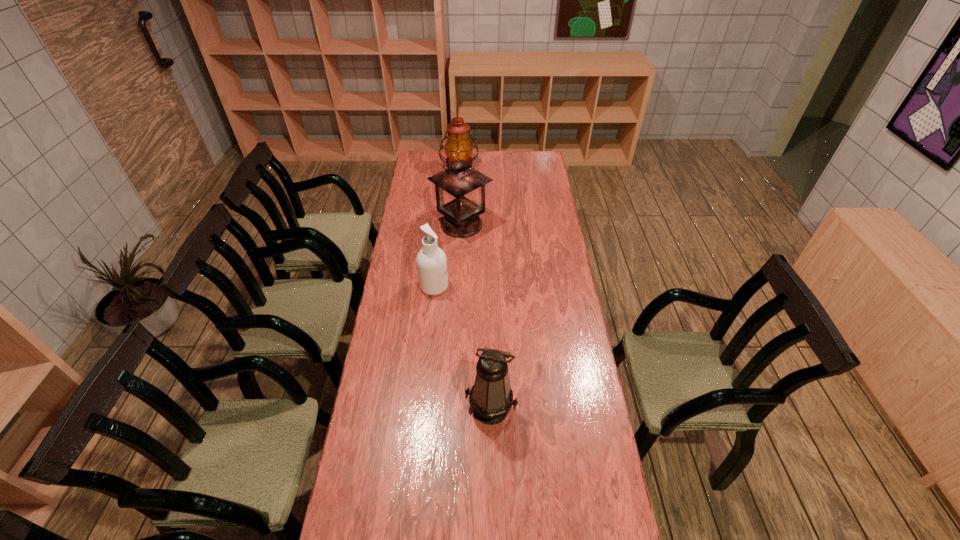
Where is `cleansing agent that is at the left edge`? cleansing agent that is at the left edge is located at coordinates (431, 261).

This screenshot has width=960, height=540. I want to click on object located at the far left corner, so click(458, 140).

Locate an element on the screen. This screenshot has height=540, width=960. vacant space at the left edge of the desktop is located at coordinates (431, 224).

This screenshot has height=540, width=960. Identify the location of free location at the right edge. (553, 382).

In the image, there is a desktop. Where is `vacant region at the far right corner`? vacant region at the far right corner is located at coordinates click(534, 159).

Image resolution: width=960 pixels, height=540 pixels. I want to click on blank region between the nearest object and the third farthest object, so click(x=463, y=347).

Where is `empty location between the second nearest oil lamp and the nearest object`? The height and width of the screenshot is (540, 960). empty location between the second nearest oil lamp and the nearest object is located at coordinates (476, 316).

Where is `blank region between the second nearest object and the second farthest oil lamp`? The height and width of the screenshot is (540, 960). blank region between the second nearest object and the second farthest oil lamp is located at coordinates (447, 255).

Select which object is the second closest to the nearest object. Please provide its 2D coordinates. Your answer should be formatted as a tuple, i.e. [(x, y)], where the tuple contains the x and y coordinates of a point satisfying the conditions above.

[(460, 190)]

I want to click on object that stands as the second closest to the shortest oil lamp, so click(460, 190).